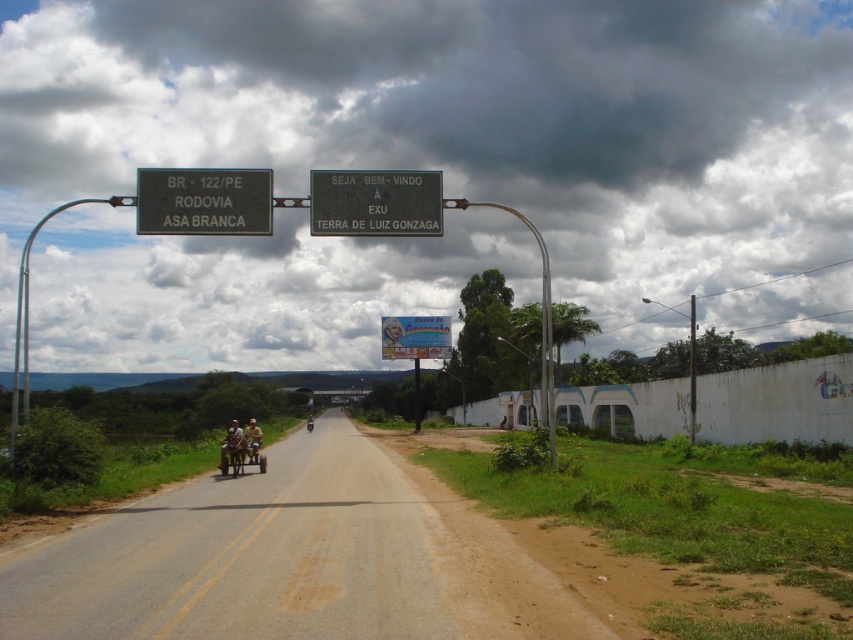
Question: Which object is farther from the camera taking this photo?

Choices:
 (A) brown dirt track at center
 (B) green metallic sign at upper center

Answer: (B)

Question: Estimate the real-world distances between objects in this image. Which object is farther from the black metal sign at upper center?

Choices:
 (A) green metallic sign at upper center
 (B) camouflage fabric shirt at center
 (C) brown leather motorcycle at center

Answer: (B)

Question: Can you confirm if black metal sign at upper center is positioned above brown leather motorcycle at center?

Choices:
 (A) no
 (B) yes

Answer: (B)

Question: Where is brown dirt track at center located in relation to camouflage fabric shirt at center in the image?

Choices:
 (A) left
 (B) right

Answer: (B)

Question: Does wooden cart at center have a smaller size compared to camouflage fabric shirt at center?

Choices:
 (A) yes
 (B) no

Answer: (A)

Question: Which point is farther to the camera?

Choices:
 (A) brown dirt track at center
 (B) green metallic sign at upper center

Answer: (B)